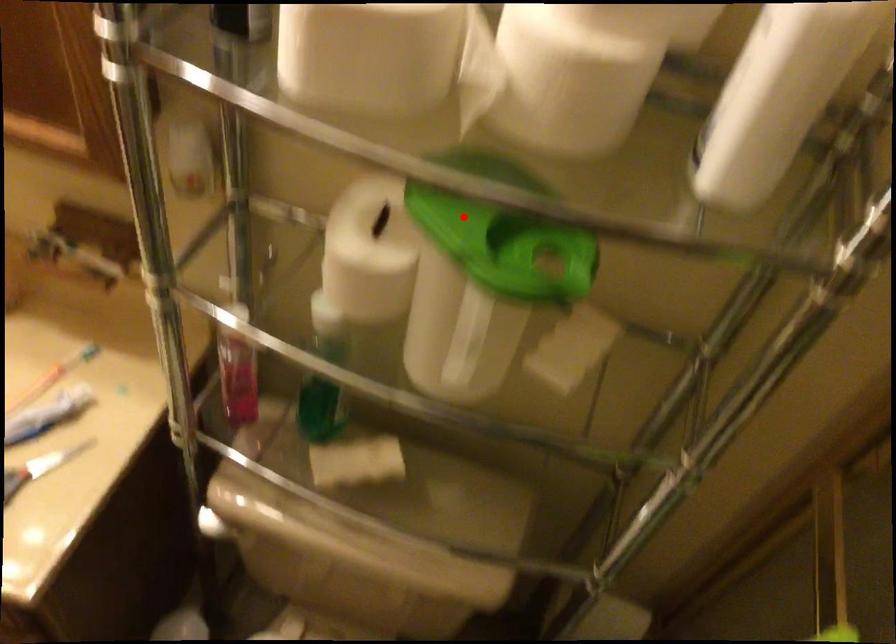
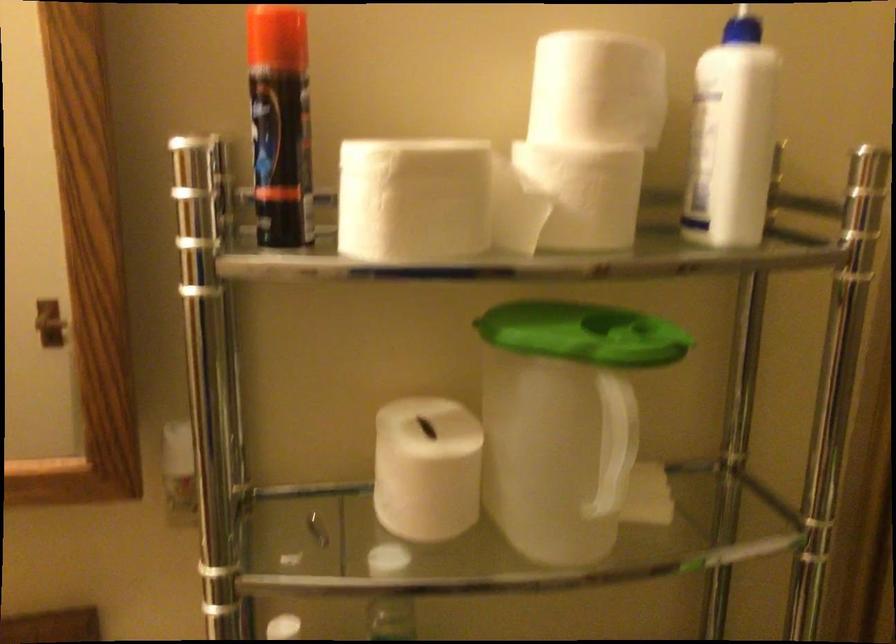
In the second image, find the point that corresponds to the highlighted location in the first image.

(563, 327)